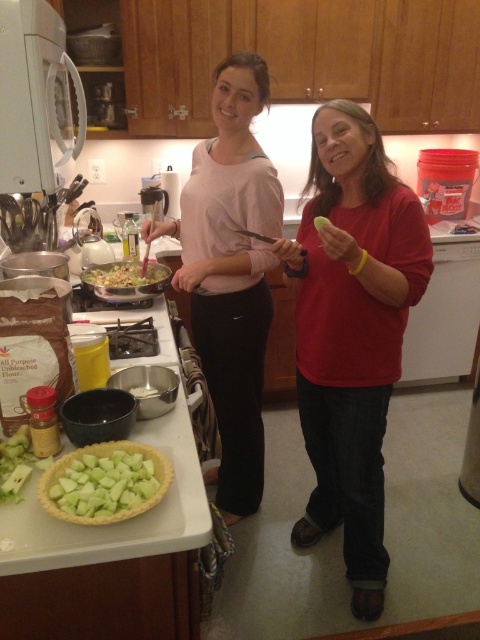
You are standing in the kitchen and want to place the green matte pie crust at lower left on the counter. The counter has a coordinate system where the bottom left corner is the origin. Can you confirm if the coordinates provided are within the counter area?

The green matte pie crust at lower left is located at point (105, 483), so yes, the coordinates are within the counter area.

Looking at this image, where is the matte pink shirt at center located in the image?

The matte pink shirt at center is located at the 2D coordinates point (x=230, y=273).